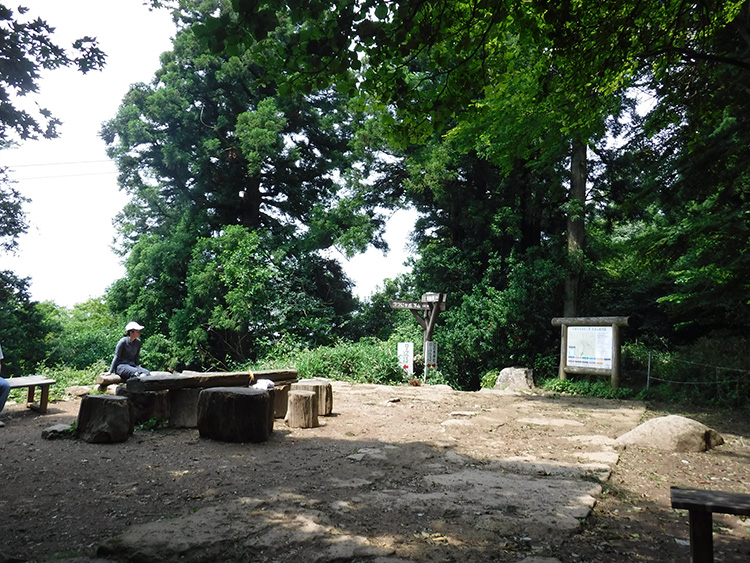
Where is `wooden bench`? Image resolution: width=750 pixels, height=563 pixels. wooden bench is located at coordinates 22,382.